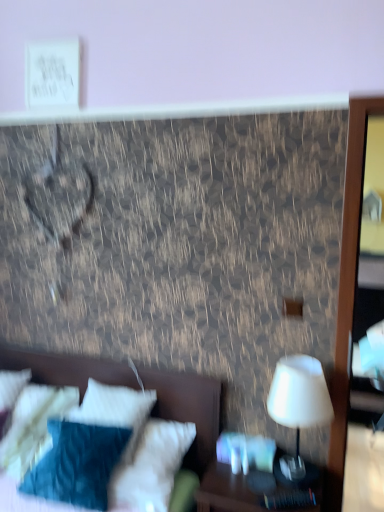
Question: From their relative heights in the image, would you say white soft pillow at lower left, which is the second pillow in left-to-right order, is taller or shorter than white matte table lamp at right?

Choices:
 (A) tall
 (B) short

Answer: (B)

Question: From a real-world perspective, is white soft pillow at lower left, which is the 1th pillow in right-to-left order, above or below white matte table lamp at right?

Choices:
 (A) below
 (B) above

Answer: (A)

Question: Which is farther from the white matte table lamp at right?

Choices:
 (A) white soft pillow at lower left, which is the second pillow in left-to-right order
 (B) white soft bed at lower left
 (C) white soft pillow at lower left, the 2th pillow positioned from the right
 (D) wooden nightstand at lower right

Answer: (C)

Question: Estimate the real-world distances between objects in this image. Which object is closer to the white soft pillow at lower left, marked as the first pillow in a left-to-right arrangement?

Choices:
 (A) white soft bed at lower left
 (B) wooden nightstand at lower right
 (C) white matte table lamp at right
 (D) white soft pillow at lower left, which is the second pillow in left-to-right order

Answer: (D)